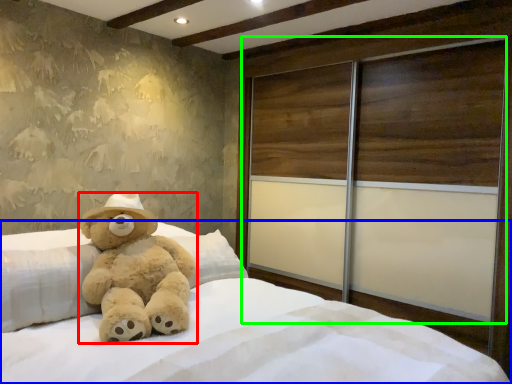
Question: Considering the real-world distances, which object is farthest from teddy bear (highlighted by a red box)? bed (highlighted by a blue box) or screen door (highlighted by a green box)?

Choices:
 (A) bed
 (B) screen door

Answer: (B)